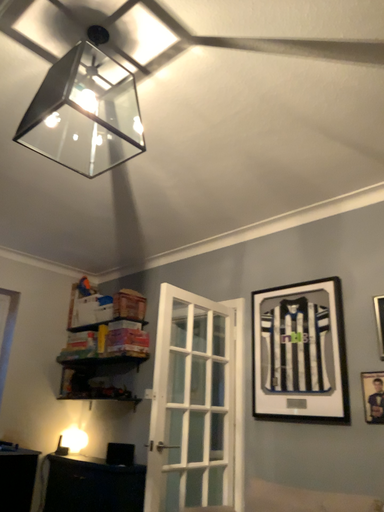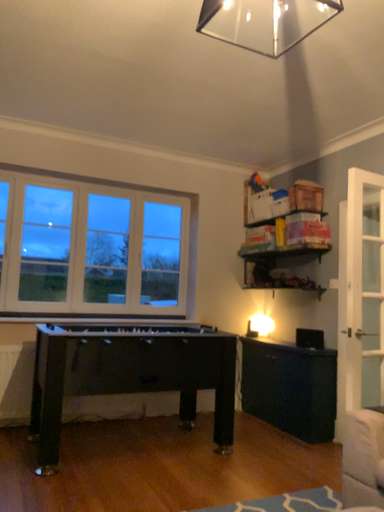
Question: Which way did the camera rotate in the video?

Choices:
 (A) rotated downward
 (B) rotated upward

Answer: (A)